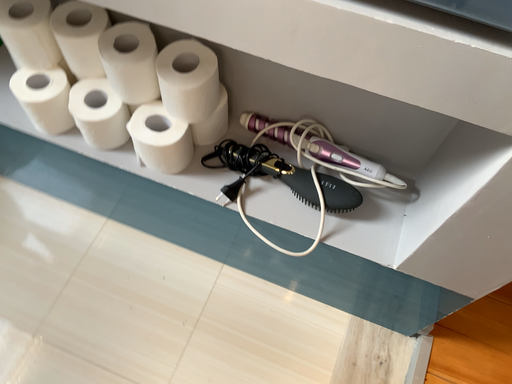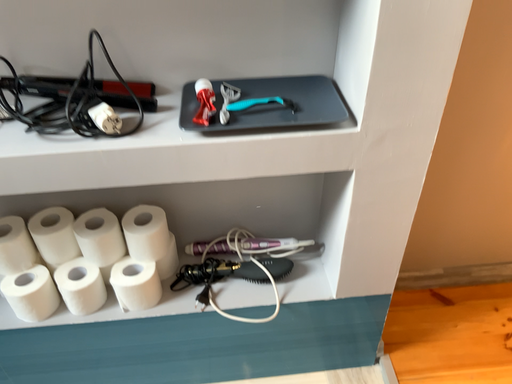
Question: How did the camera likely rotate when shooting the video?

Choices:
 (A) rotated upward
 (B) rotated downward

Answer: (A)